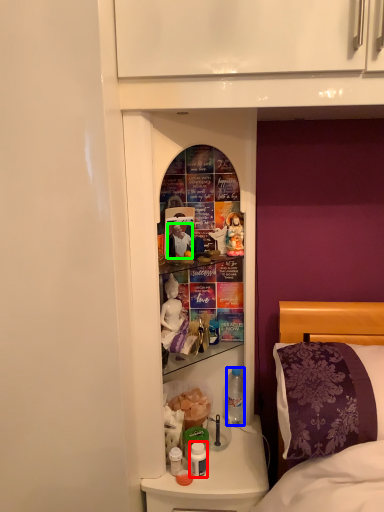
Question: Estimate the real-world distances between objects in this image. Which object is closer to bottle (highlighted by a red box), bottle (highlighted by a blue box) or person (highlighted by a green box)?

Choices:
 (A) bottle
 (B) person

Answer: (A)